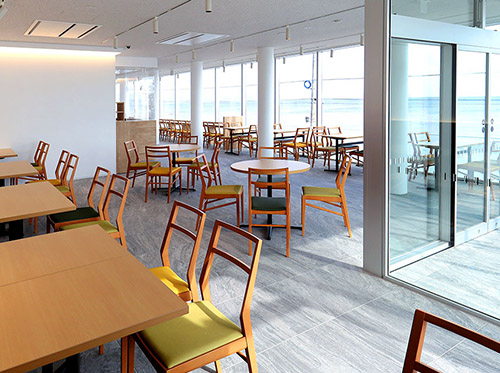
This screenshot has width=500, height=373. Identify the location of tables on the left side of the picture. (72, 321), (31, 250), (29, 181), (14, 162), (7, 147).